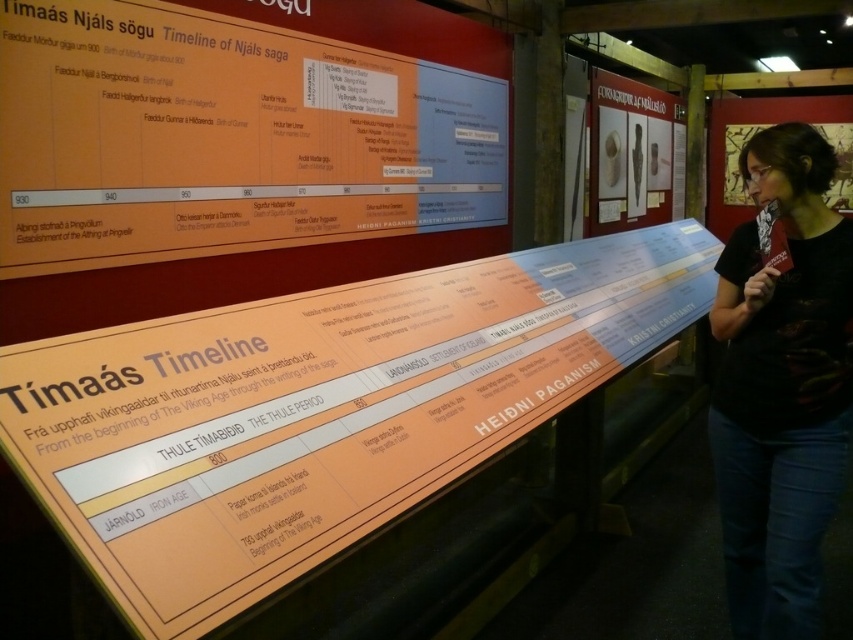
Question: Is matte plastic timeline at center to the right of matte orange wall at upper left from the viewer's perspective?

Choices:
 (A) no
 (B) yes

Answer: (B)

Question: From the image, what is the correct spatial relationship of matte plastic timeline at center in relation to matte black poster at upper right?

Choices:
 (A) below
 (B) above

Answer: (A)

Question: Can you confirm if matte orange wall at upper left is bigger than matte white vase at upper right?

Choices:
 (A) yes
 (B) no

Answer: (A)

Question: Which object appears closest to the camera in this image?

Choices:
 (A) matte orange wall at upper left
 (B) black fabric shirt at center
 (C) matte plastic timeline at center

Answer: (C)

Question: Among these points, which one is nearest to the camera?

Choices:
 (A) (256, 332)
 (B) (726, 412)
 (C) (659, 211)
 (D) (845, 209)

Answer: (A)

Question: Which of the following is the farthest from the observer?

Choices:
 (A) (640, 99)
 (B) (799, 323)

Answer: (A)